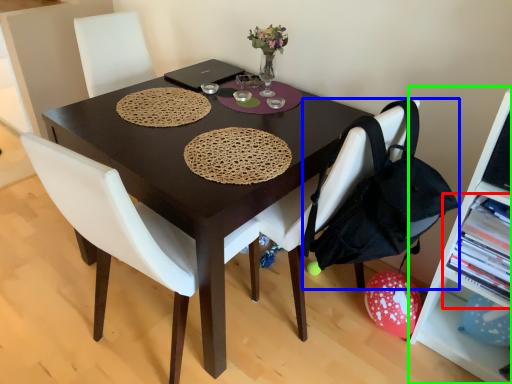
Question: Which object is the closest to the shelf (highlighted by a red box)? Choose among these: handbag (highlighted by a blue box) or shelf (highlighted by a green box).

Choices:
 (A) handbag
 (B) shelf

Answer: (B)